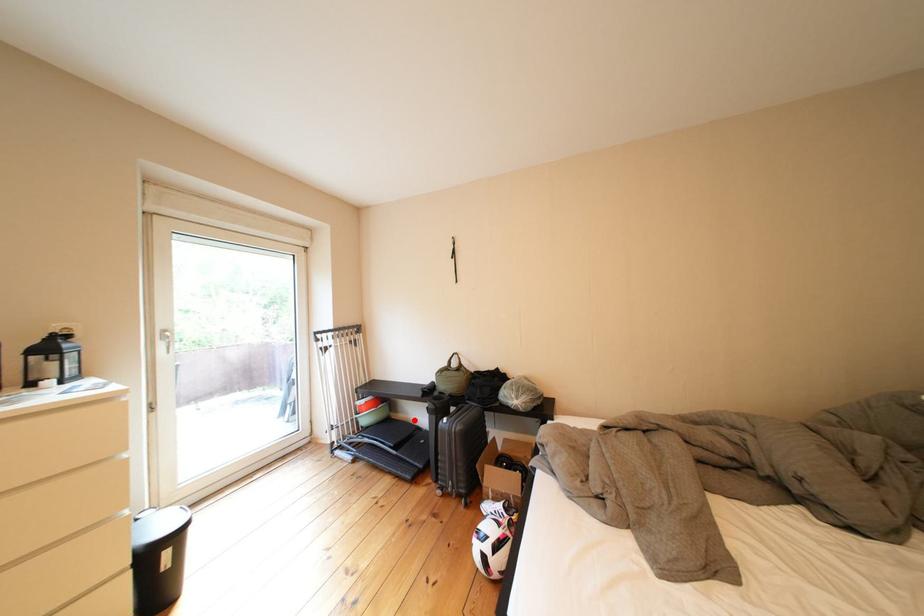
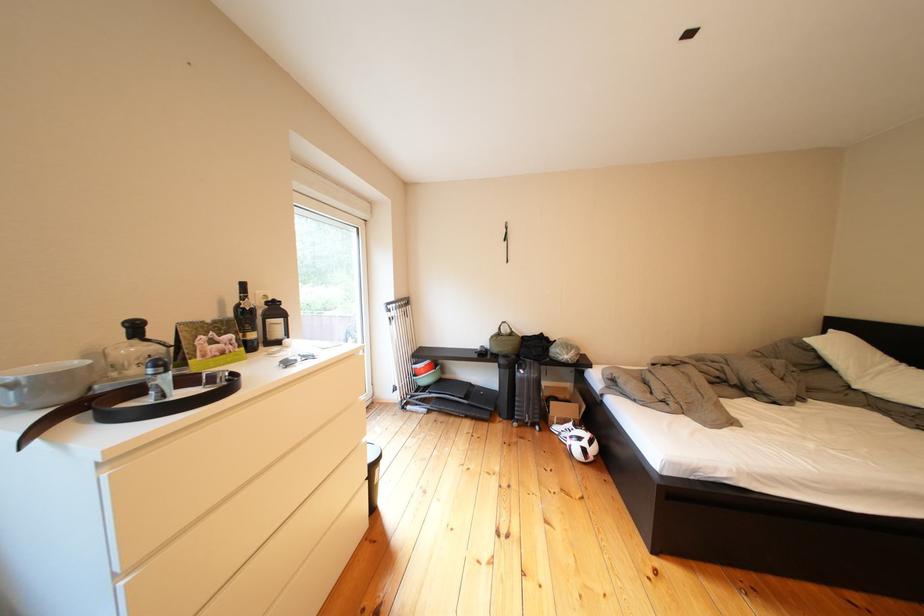
Locate, in the second image, the point that corresponds to the highlighted location in the first image.

(462, 381)